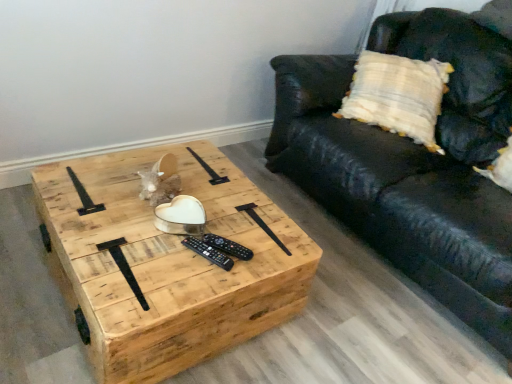
You are a GUI agent. You are given a task and a screenshot of the screen. Output one action in this format:
    pyautogui.click(x=<x>, y=<y>)
    Task: Click on the vacant area to the left of black plastic remote at center, which is the 1th remote from back to front
    The image size is (512, 384).
    Given the screenshot: What is the action you would take?
    pyautogui.click(x=153, y=247)